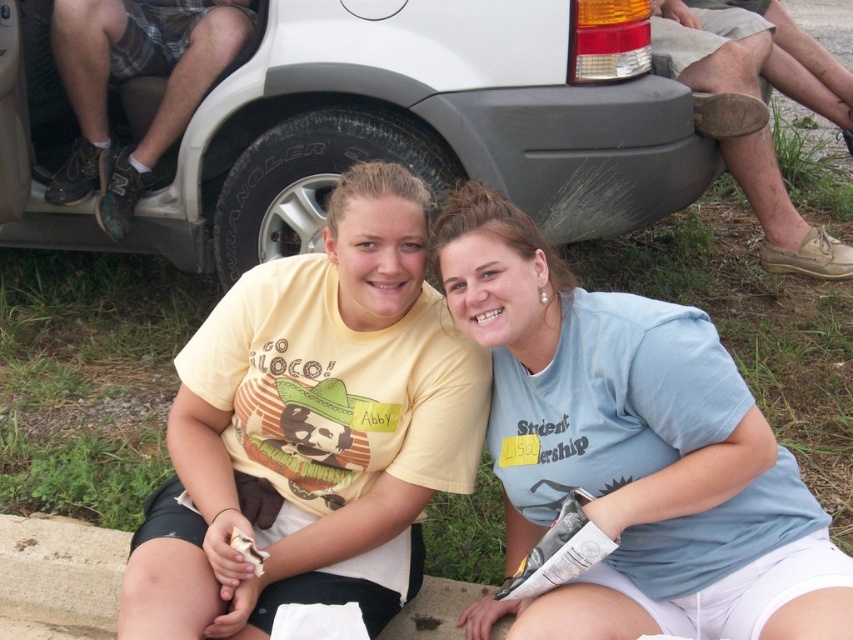
Does point (740, 435) lie in front of point (218, 250)?

Yes, point (740, 435) is in front of point (218, 250).

What do you see at coordinates (631, 451) in the screenshot? I see `light blue cotton shirt at center` at bounding box center [631, 451].

Does point (761, 497) lie behind point (314, 195)?

No, (761, 497) is closer to viewer.

Image resolution: width=853 pixels, height=640 pixels. Find the location of `light blue cotton shirt at center`. light blue cotton shirt at center is located at coordinates (631, 451).

In the scene shown: Does white matte suv at center lie behind light blue cotton shirt at center?

Yes, white matte suv at center is behind light blue cotton shirt at center.

Can you confirm if white matte suv at center is smaller than light blue cotton shirt at center?

No.

Find the location of a particular element. white matte suv at center is located at coordinates (374, 125).

Is light blue cotton shirt at center above brown leather shoe at lower right?

Actually, light blue cotton shirt at center is below brown leather shoe at lower right.

The image size is (853, 640). Find the location of `light blue cotton shirt at center`. light blue cotton shirt at center is located at coordinates (631, 451).

I want to click on light blue cotton shirt at center, so click(631, 451).